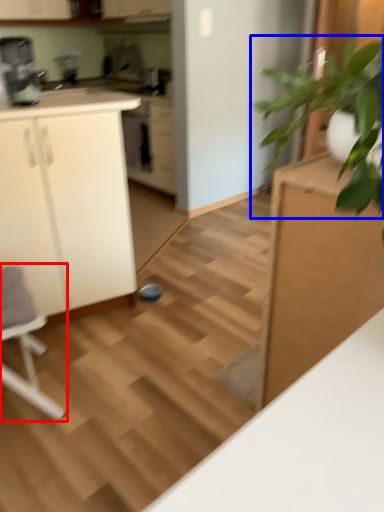
Question: Among these objects, which one is nearest to the camera, rocking chair (highlighted by a red box) or houseplant (highlighted by a blue box)?

Choices:
 (A) rocking chair
 (B) houseplant

Answer: (B)